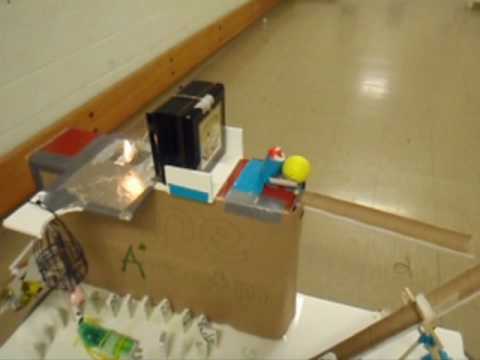
In order to click on white shelf in this screenshot , I will do click(x=184, y=315), click(x=164, y=311), click(x=144, y=304), click(x=125, y=302), click(x=110, y=301), click(x=201, y=322), click(x=200, y=181).